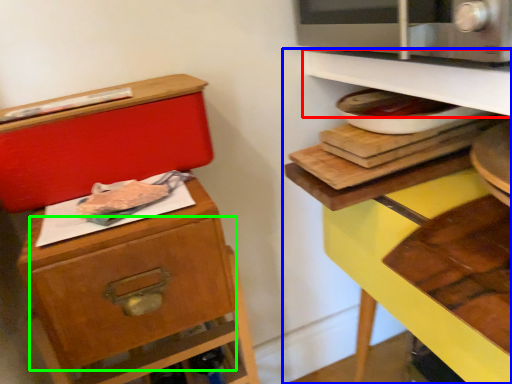
Question: Which is farther away from shelf (highlighted by a red box)? shelf (highlighted by a blue box) or drawer (highlighted by a green box)?

Choices:
 (A) shelf
 (B) drawer

Answer: (B)